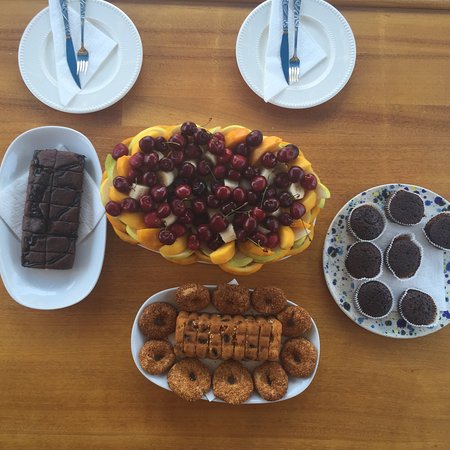
Locate an element on the screen. Image resolution: width=450 pixels, height=450 pixels. plates is located at coordinates (169, 295), (102, 270), (334, 268), (331, 69), (89, 100).